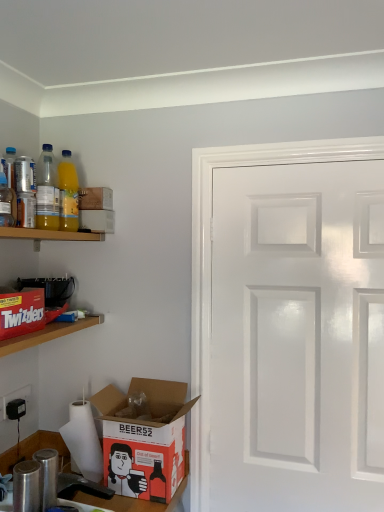
Question: From a real-world perspective, is matte cardboard box at upper left, which is counted as the 1th box, starting from the top, positioned above or below matte cardboard box at upper left, which appears as the 2th box when ordered from the bottom?

Choices:
 (A) below
 (B) above

Answer: (B)

Question: Is matte cardboard box at upper left, which is counted as the 1th box, starting from the top, taller or shorter than matte cardboard box at upper left, the second box from the top?

Choices:
 (A) tall
 (B) short

Answer: (A)

Question: Based on their relative distances, which object is nearer to the white glossy door at right?

Choices:
 (A) translucent plastic bottle at upper left, placed as the second bottle when sorted from right to left
 (B) wooden shelf at upper left, which is the first shelf in top-to-bottom order
 (C) matte cardboard box at upper left, which ranks as the 3th box in bottom-to-top order
 (D) yellow translucent bottle at upper left, the fourth bottle positioned from the front
 (E) matte cardboard box at upper left, the second box from the top

Answer: (E)

Question: Which object is positioned farthest from the translucent plastic bottle at upper left, positioned as the second bottle in left-to-right order?

Choices:
 (A) matte red cardboard box at left
 (B) brushed metal shaker at lower left, the 2th appliance viewed from the top
 (C) metallic can at upper left, the 2th bottle in the front-to-back sequence
 (D) matte cardboard box at upper left, which ranks as the 3th box in bottom-to-top order
 (E) white matte paper towel at lower left

Answer: (B)